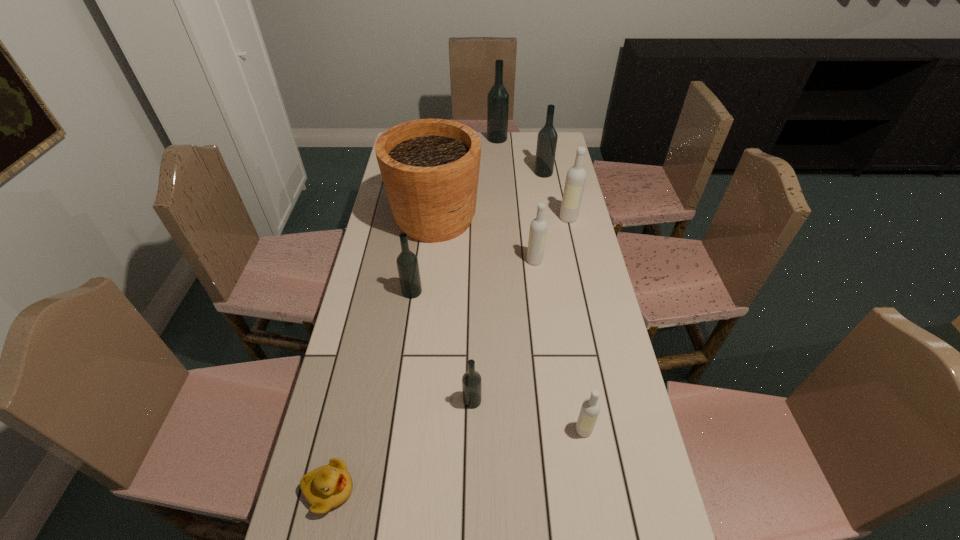
The width and height of the screenshot is (960, 540). I want to click on the leftmost vodka, so click(407, 262).

You are a GUI agent. You are given a task and a screenshot of the screen. Output one action in this format:
    pyautogui.click(x=<x>, y=<y>)
    Task: Click on the nearest white vodka
    This screenshot has width=960, height=540.
    Given the screenshot: What is the action you would take?
    pyautogui.click(x=590, y=409)

Image resolution: width=960 pixels, height=540 pixels. Identify the location of the smallest white vodka. (590, 409).

This screenshot has width=960, height=540. Identify the location of the sixth vodka from right to left. (471, 381).

Where is `the second nearest vodka`? This screenshot has height=540, width=960. the second nearest vodka is located at coordinates (471, 381).

Identify the location of the nearest object. The width and height of the screenshot is (960, 540). (326, 487).

Locate an element on the screen. duckling is located at coordinates (326, 487).

This screenshot has height=540, width=960. What are the coordinates of `vacant space positioned 0.110m on the right of the farthest black vodka` in the screenshot? It's located at (530, 139).

Identify the location of free region located on the back of the flowerpot. (441, 172).

At what (x,y) coordinates should I click in order to perform the action: click on free region located 0.080m on the front of the second biggest black vodka. Please return your answer as a coordinate pair (x, y). The image size is (960, 540). Looking at the image, I should click on (546, 189).